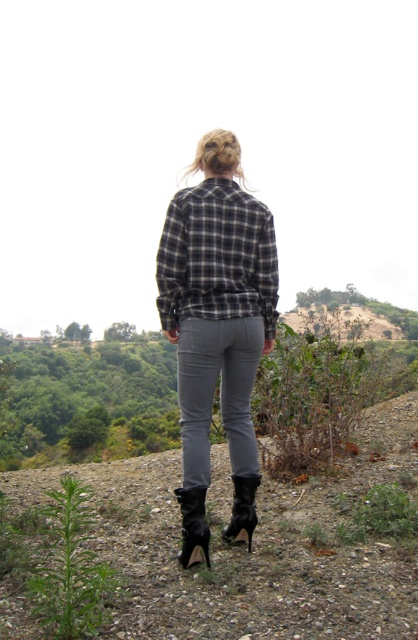
Question: Which point is farther to the camera?

Choices:
 (A) black patent leather boot at lower center
 (B) matte gray pants at center
 (C) black flannel shirt at center
 (D) black leather boot at lower center

Answer: (A)

Question: Considering the real-world distances, which object is closest to the black flannel shirt at center?

Choices:
 (A) matte gray pants at center
 (B) matte black boots at center

Answer: (B)

Question: Which object is positioned closest to the black flannel shirt at center?

Choices:
 (A) black leather boot at lower center
 (B) matte gray pants at center

Answer: (B)

Question: Does black flannel shirt at center lie in front of black patent leather boot at lower center?

Choices:
 (A) yes
 (B) no

Answer: (A)

Question: Does black flannel shirt at center have a lesser width compared to black leather boot at lower center?

Choices:
 (A) no
 (B) yes

Answer: (A)

Question: Is matte gray pants at center smaller than black patent leather boot at lower center?

Choices:
 (A) no
 (B) yes

Answer: (A)